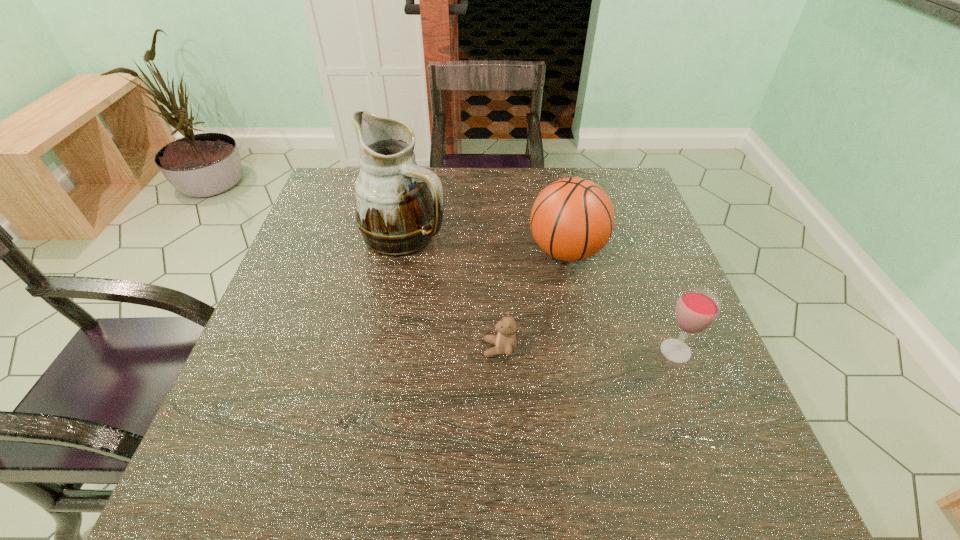
This screenshot has height=540, width=960. What are the coordinates of `free space located on the back of the second shortest object` in the screenshot? It's located at (634, 241).

This screenshot has width=960, height=540. I want to click on free spot located on the front-facing side of the teddy bear, so click(x=386, y=349).

This screenshot has width=960, height=540. What are the coordinates of `free location located 0.360m on the front-facing side of the teddy bear` in the screenshot? It's located at (308, 349).

Locate an element on the screen. Image resolution: width=960 pixels, height=540 pixels. vacant area located 0.070m on the front-facing side of the teddy bear is located at coordinates (449, 349).

Locate an element on the screen. This screenshot has height=540, width=960. object at the far edge is located at coordinates (399, 206).

Locate an element on the screen. The height and width of the screenshot is (540, 960). object at the left edge is located at coordinates [x=399, y=206].

Locate an element on the screen. Image resolution: width=960 pixels, height=540 pixels. basketball at the right edge is located at coordinates (572, 219).

At what (x,y) coordinates should I click in order to perform the action: click on wineglass situated at the right edge. Please return your answer as a coordinate pair (x, y). Image resolution: width=960 pixels, height=540 pixels. Looking at the image, I should click on (696, 310).

What are the coordinates of `object located at the far left corner` in the screenshot? It's located at (399, 206).

Where is `free spot at the far edge of the desktop`? This screenshot has height=540, width=960. free spot at the far edge of the desktop is located at coordinates (546, 176).